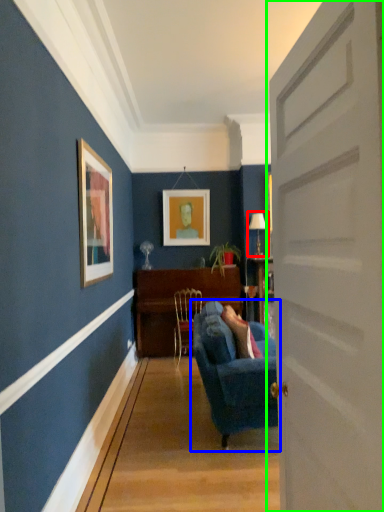
Question: Based on their relative distances, which object is nearer to lamp (highlighted by a red box)? Choose from studio couch (highlighted by a blue box) and door (highlighted by a green box).

Choices:
 (A) studio couch
 (B) door

Answer: (A)